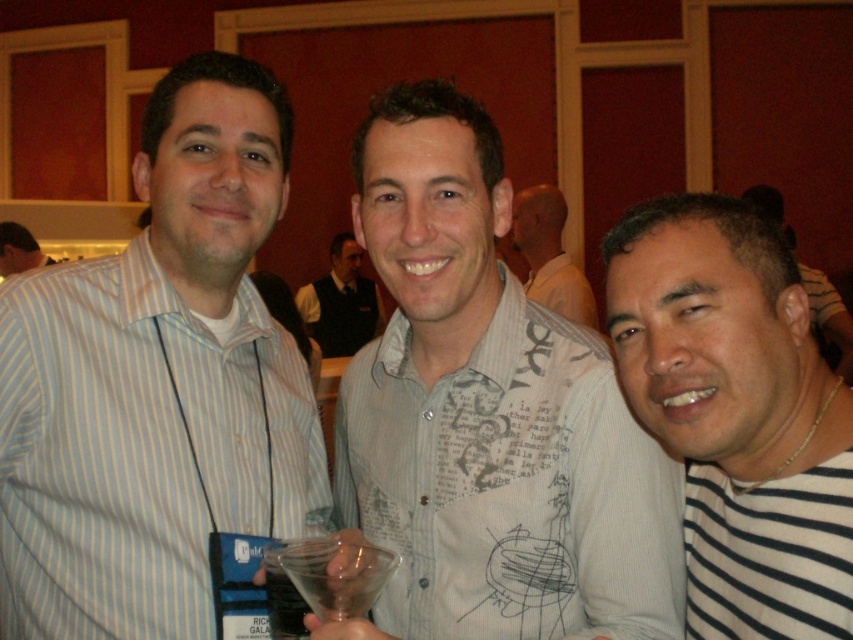
Can you confirm if light blue striped shirt at left is bigger than light gray printed shirt at center?

Actually, light blue striped shirt at left might be smaller than light gray printed shirt at center.

Which is above, light blue striped shirt at left or light gray printed shirt at center?

Positioned higher is light blue striped shirt at left.

Is point (119, 333) positioned after point (438, 260)?

Yes, it is behind point (438, 260).

Where is `light blue striped shirt at left`? The height and width of the screenshot is (640, 853). light blue striped shirt at left is located at coordinates (157, 384).

Does black striped shirt at right have a greater height compared to transparent plastic martini glass at center?

Correct, black striped shirt at right is much taller as transparent plastic martini glass at center.

Is black striped shirt at right thinner than transparent plastic martini glass at center?

No, black striped shirt at right is not thinner than transparent plastic martini glass at center.

Who is more distant from viewer, (728, 352) or (343, 595)?

Positioned behind is point (728, 352).

Identify the location of black striped shirt at right. (737, 413).

Is point (524, 211) in front of point (303, 627)?

No.

The height and width of the screenshot is (640, 853). I want to click on white printed shirt at center, so click(x=550, y=253).

Where is `white printed shirt at center`? The height and width of the screenshot is (640, 853). white printed shirt at center is located at coordinates (550, 253).